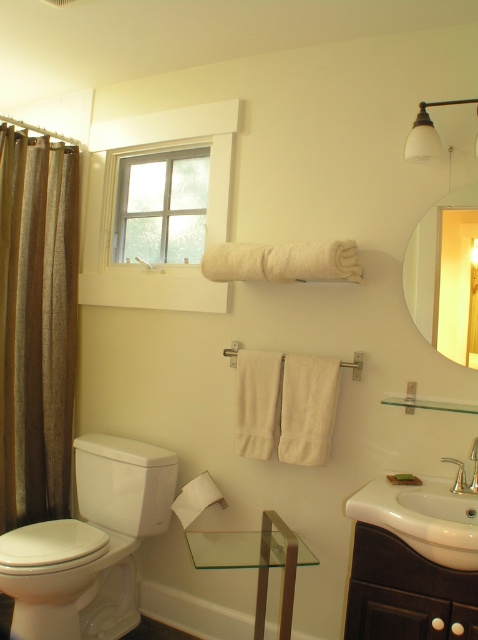
Who is shorter, clear glass window at upper center or matte glass mirror at upper right?

clear glass window at upper center

Who is higher up, clear glass window at upper center or matte glass mirror at upper right?

clear glass window at upper center

The width and height of the screenshot is (478, 640). Identify the location of clear glass window at upper center. (162, 205).

Who is lower down, clear glass window at upper center or polished chrome faucet at sink right?

polished chrome faucet at sink right is lower down.

Is clear glass window at upper center to the right of polished chrome faucet at sink right from the viewer's perspective?

No, clear glass window at upper center is not to the right of polished chrome faucet at sink right.

Image resolution: width=478 pixels, height=640 pixels. What do you see at coordinates (162, 205) in the screenshot? I see `clear glass window at upper center` at bounding box center [162, 205].

In order to click on clear glass window at upper center in this screenshot , I will do `click(162, 205)`.

Is white glossy toilet bowl at lower left positioned before clear glass window at upper center?

Yes, it is in front of clear glass window at upper center.

Between white glossy toilet bowl at lower left and clear glass window at upper center, which one is positioned lower?

white glossy toilet bowl at lower left is lower down.

Who is more forward, (117,580) or (165,250)?

Point (117,580) is in front.

This screenshot has width=478, height=640. I want to click on white glossy toilet bowl at lower left, so click(89, 545).